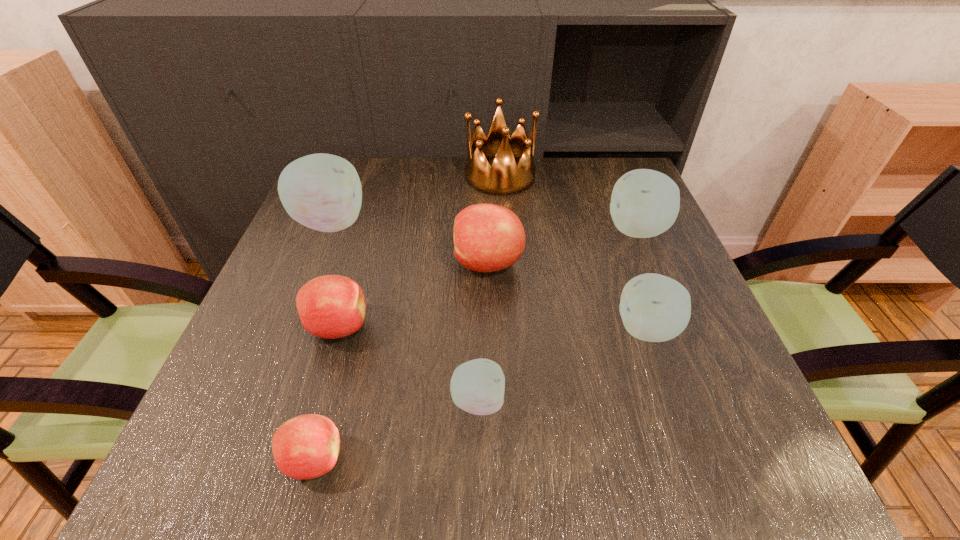
Where is `vacant region that satisfies the following two spatial constraints: 1. on the front side of the third biggest white apple; 2. on the right side of the biggest white apple`? vacant region that satisfies the following two spatial constraints: 1. on the front side of the third biggest white apple; 2. on the right side of the biggest white apple is located at coordinates (288, 329).

Where is `vacant space that satisfies the following two spatial constraints: 1. on the back side of the third smallest white apple; 2. on the right side of the nearest white apple`? vacant space that satisfies the following two spatial constraints: 1. on the back side of the third smallest white apple; 2. on the right side of the nearest white apple is located at coordinates (478, 230).

The width and height of the screenshot is (960, 540). Find the location of `free region that satisfies the following two spatial constraints: 1. on the back side of the third smallest white apple; 2. on the left side of the farthest red apple`. free region that satisfies the following two spatial constraints: 1. on the back side of the third smallest white apple; 2. on the left side of the farthest red apple is located at coordinates (488, 230).

At what (x,y) coordinates should I click in order to perform the action: click on vacant position in the image that satisfies the following two spatial constraints: 1. on the back side of the farthest object; 2. on the right side of the second farthest red apple. Please return your answer as a coordinate pair (x, y). This screenshot has height=540, width=960. Looking at the image, I should click on (382, 176).